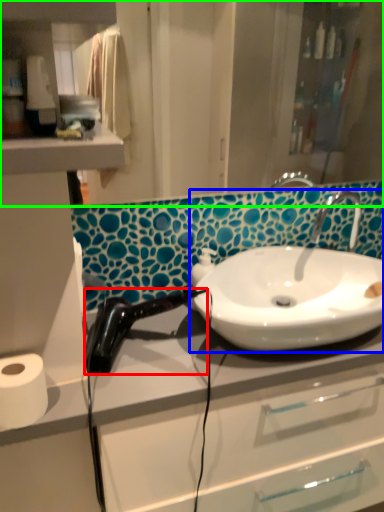
Question: Which object is positioned closest to hair drier (highlighted by a red box)? Select from sink (highlighted by a blue box) and mirror (highlighted by a green box).

Choices:
 (A) sink
 (B) mirror

Answer: (A)